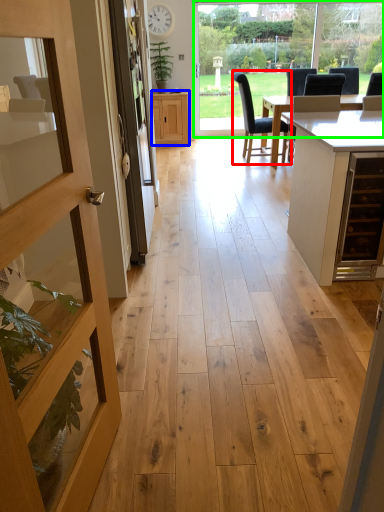
Question: Which is nearer to the chair (highlighted by a red box)? cabinetry (highlighted by a blue box) or window frame (highlighted by a green box).

Choices:
 (A) cabinetry
 (B) window frame

Answer: (A)